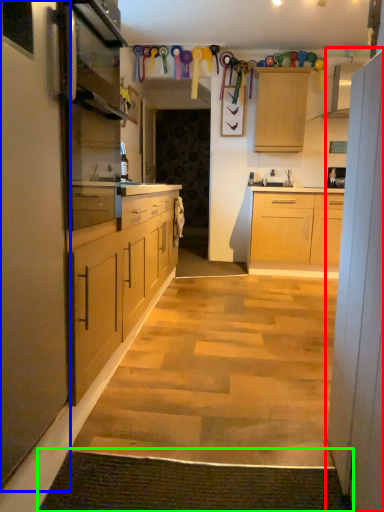
Question: Estimate the real-world distances between objects in this image. Which object is farther from cabinet (highlighted by a red box), cabinet (highlighted by a blue box) or doormat (highlighted by a green box)?

Choices:
 (A) cabinet
 (B) doormat

Answer: (A)